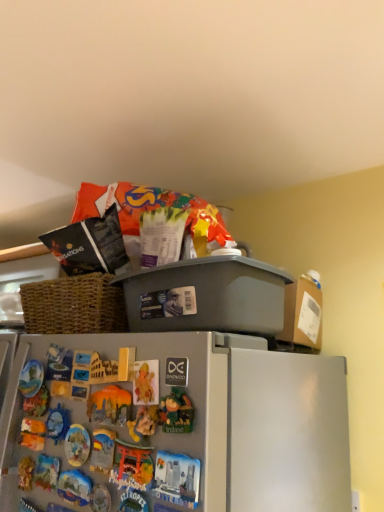
Question: Considering the relative positions of matte plastic toy at center and gray plastic bin at upper center in the image provided, is matte plastic toy at center to the left of gray plastic bin at upper center from the viewer's perspective?

Choices:
 (A) no
 (B) yes

Answer: (B)

Question: Can you confirm if matte plastic toy at center is bigger than gray plastic bin at upper center?

Choices:
 (A) yes
 (B) no

Answer: (B)

Question: From the image's perspective, is matte plastic toy at center on top of gray plastic bin at upper center?

Choices:
 (A) no
 (B) yes

Answer: (A)

Question: Is gray plastic bin at upper center a part of matte plastic toy at center?

Choices:
 (A) no
 (B) yes

Answer: (A)

Question: Is matte plastic toy at center not close to gray plastic bin at upper center?

Choices:
 (A) no
 (B) yes

Answer: (A)

Question: Does matte plastic toy at center have a greater width compared to gray plastic bin at upper center?

Choices:
 (A) no
 (B) yes

Answer: (A)

Question: Considering the relative sizes of gray plastic bin at upper center and matte plastic toy at center in the image provided, is gray plastic bin at upper center taller than matte plastic toy at center?

Choices:
 (A) yes
 (B) no

Answer: (A)

Question: Considering the relative positions of gray plastic bin at upper center and matte plastic toy at center in the image provided, is gray plastic bin at upper center to the left of matte plastic toy at center from the viewer's perspective?

Choices:
 (A) no
 (B) yes

Answer: (A)

Question: Considering the relative positions of gray plastic bin at upper center and matte plastic toy at center in the image provided, is gray plastic bin at upper center behind matte plastic toy at center?

Choices:
 (A) no
 (B) yes

Answer: (B)

Question: Is matte plastic toy at center located within gray plastic bin at upper center?

Choices:
 (A) no
 (B) yes

Answer: (A)

Question: Is gray plastic bin at upper center aimed at matte plastic toy at center?

Choices:
 (A) yes
 (B) no

Answer: (B)

Question: Is gray plastic bin at upper center facing away from matte plastic toy at center?

Choices:
 (A) yes
 (B) no

Answer: (B)

Question: Relative to matte plastic toy at center, is gray plastic bin at upper center in front or behind?

Choices:
 (A) behind
 (B) front

Answer: (A)